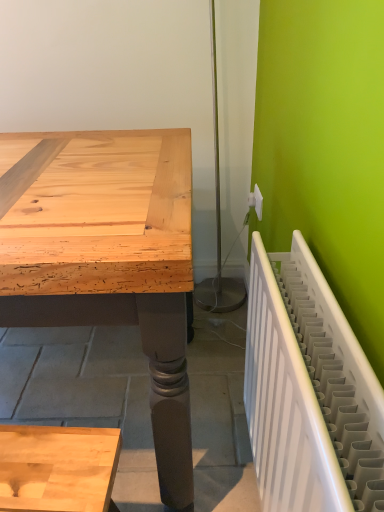
Question: Does white plastic electric outlet at upper right lie in front of white plastic radiator at right?

Choices:
 (A) yes
 (B) no

Answer: (B)

Question: Is white plastic electric outlet at upper right bigger than white plastic radiator at right?

Choices:
 (A) no
 (B) yes

Answer: (A)

Question: Considering the relative sizes of white plastic electric outlet at upper right and white plastic radiator at right in the image provided, is white plastic electric outlet at upper right shorter than white plastic radiator at right?

Choices:
 (A) yes
 (B) no

Answer: (A)

Question: Could you tell me if white plastic electric outlet at upper right is turned towards white plastic radiator at right?

Choices:
 (A) no
 (B) yes

Answer: (A)

Question: Is white plastic electric outlet at upper right not inside white plastic radiator at right?

Choices:
 (A) no
 (B) yes

Answer: (B)

Question: Considering the relative sizes of white plastic electric outlet at upper right and white plastic radiator at right in the image provided, is white plastic electric outlet at upper right smaller than white plastic radiator at right?

Choices:
 (A) no
 (B) yes

Answer: (B)

Question: From the image's perspective, would you say white plastic radiator at right is shown under white plastic electric outlet at upper right?

Choices:
 (A) yes
 (B) no

Answer: (A)

Question: Can you confirm if white plastic radiator at right is taller than white plastic electric outlet at upper right?

Choices:
 (A) no
 (B) yes

Answer: (B)

Question: Is the depth of white plastic radiator at right greater than that of white plastic electric outlet at upper right?

Choices:
 (A) no
 (B) yes

Answer: (A)

Question: Could you tell me if white plastic radiator at right is facing white plastic electric outlet at upper right?

Choices:
 (A) no
 (B) yes

Answer: (A)

Question: Considering the relative positions of white plastic radiator at right and white plastic electric outlet at upper right in the image provided, is white plastic radiator at right to the right of white plastic electric outlet at upper right from the viewer's perspective?

Choices:
 (A) yes
 (B) no

Answer: (B)

Question: Can you confirm if white plastic radiator at right is bigger than white plastic electric outlet at upper right?

Choices:
 (A) yes
 (B) no

Answer: (A)

Question: From a real-world perspective, is white plastic electric outlet at upper right physically located above or below white plastic radiator at right?

Choices:
 (A) below
 (B) above

Answer: (B)